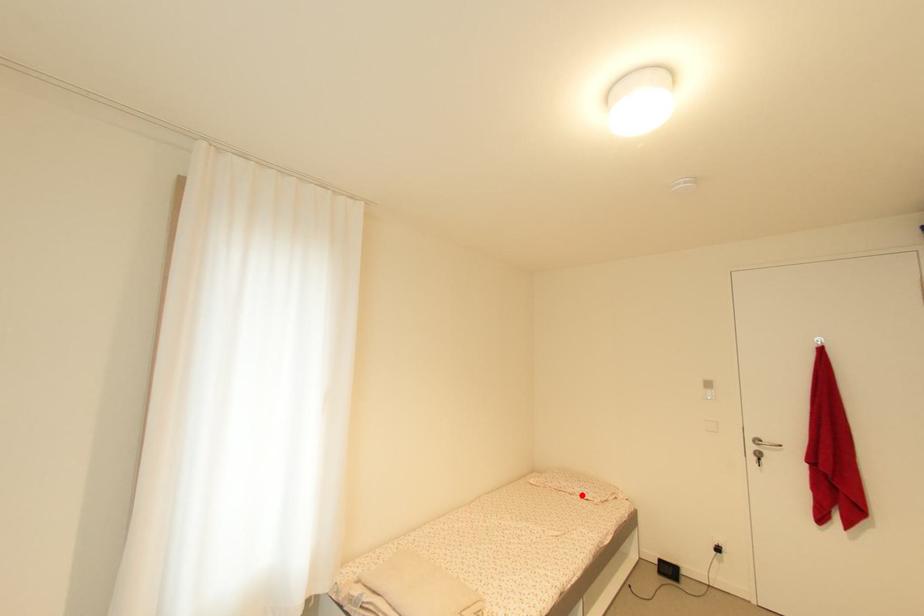
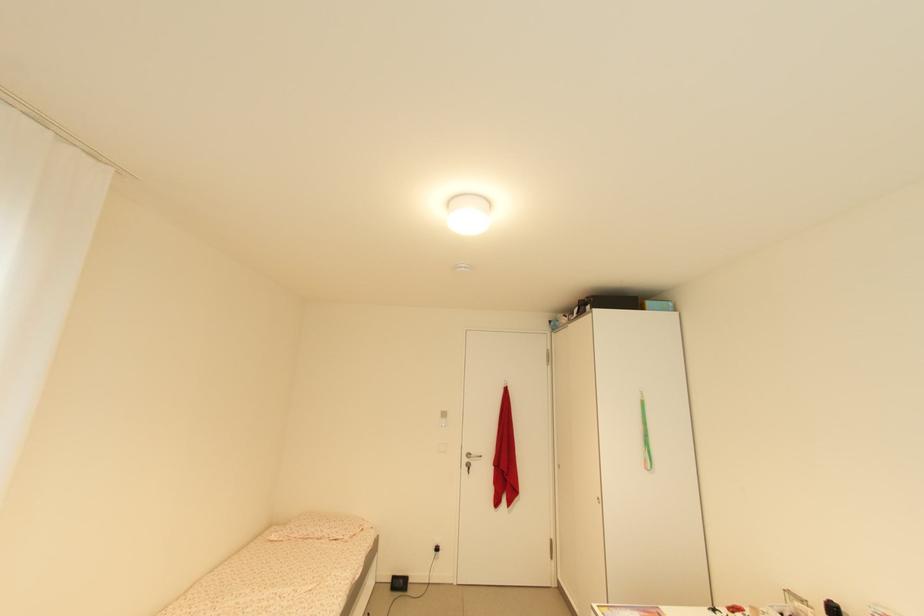
In the second image, find the point that corresponds to the highlighted location in the first image.

(332, 538)